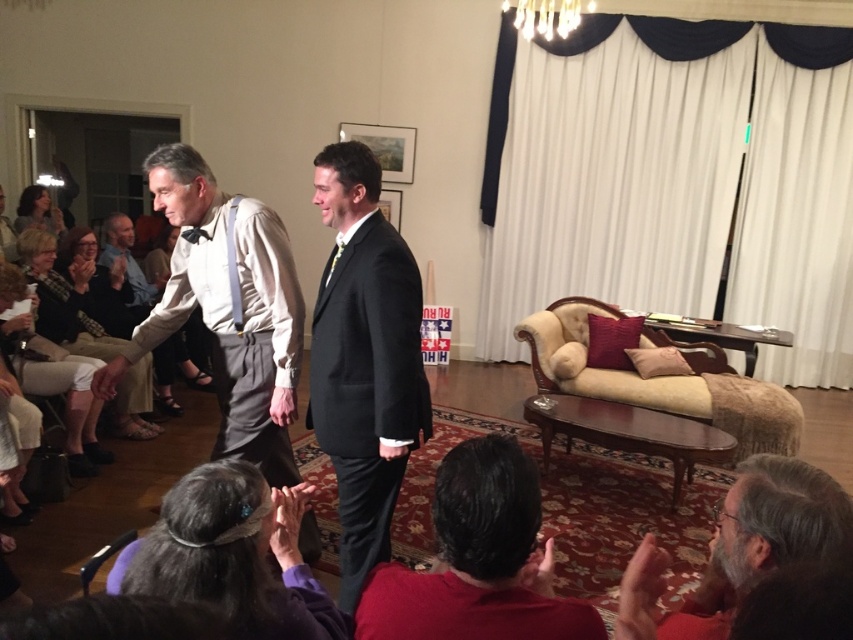
You are a photographer at the event and want to capture a photo of both the black satin suit at center and the matte black hair at upper left in the same frame. Based on their positions, which one should you focus on first to ensure both are in the shot?

The black satin suit at center is to the right of matte black hair at upper left, so you should focus on the matte black hair at upper left first to ensure both are in the shot.

Based on the scene description, can you determine the spatial relationship between the black satin suit at center and the matte black hair at upper left?

The black satin suit at center is below matte black hair at upper left.

You are a photographer setting up for a group photo. You need to ensure that the black satin suit at center and the matte black hair at upper left are both visible in the frame. Given their sizes, which object should you prioritize positioning closer to the camera to maintain clarity?

The black satin suit at center is narrower than the matte black hair at upper left, so you should prioritize positioning the black satin suit at center closer to the camera to ensure it remains clear in the photo.